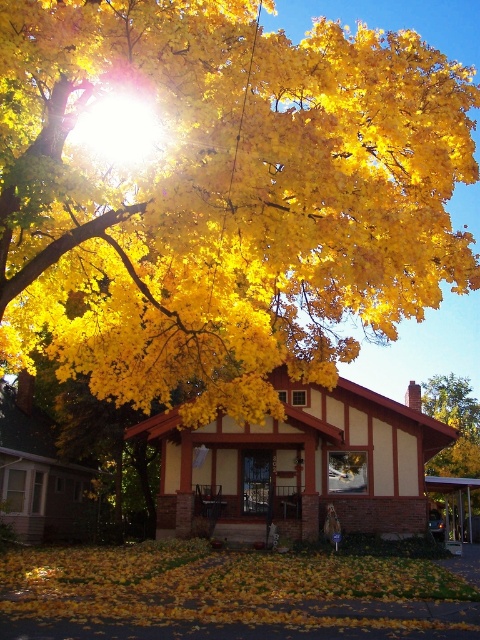
Question: Is golden yellow leaves at upper center smaller than yellow matte tree at center?

Choices:
 (A) no
 (B) yes

Answer: (A)

Question: Which point is closer to the camera?

Choices:
 (A) (8, 566)
 (B) (207, 294)
 (C) (466, 474)

Answer: (B)

Question: Which is farther from the golden yellow leaves at upper center?

Choices:
 (A) yellow dry leaves at lower center
 (B) yellow matte tree at center

Answer: (B)

Question: Which point appears farthest from the camera in this image?

Choices:
 (A) (67, 595)
 (B) (462, 388)
 (C) (190, 262)

Answer: (B)

Question: Does yellow dry leaves at lower center appear over yellow matte tree at center?

Choices:
 (A) yes
 (B) no

Answer: (A)

Question: Considering the relative positions of golden yellow leaves at upper center and yellow dry leaves at lower center in the image provided, where is golden yellow leaves at upper center located with respect to yellow dry leaves at lower center?

Choices:
 (A) right
 (B) left

Answer: (A)